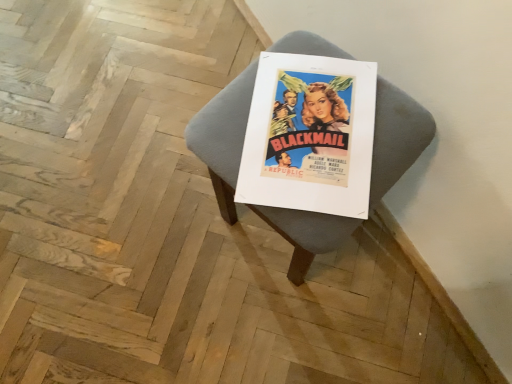
Locate an element on the screen. free space above matte gray cushion at center (from a real-world perspective) is located at coordinates (313, 125).